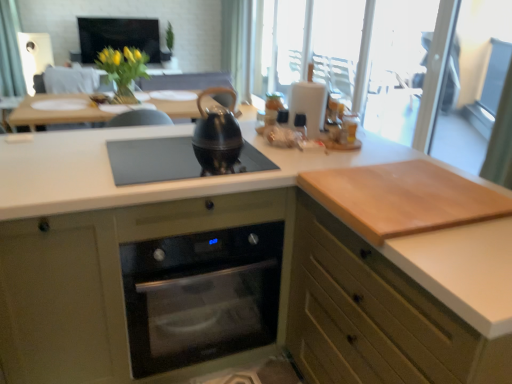
Identify the location of free point above black glass gas stove at center (from a real-world perspective). (177, 158).